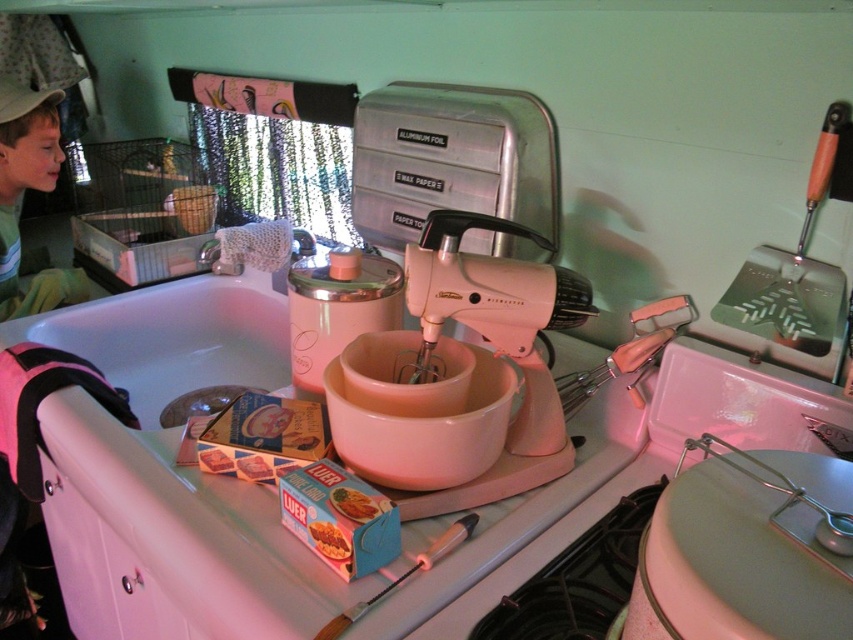
Does pink plastic mixer at center come behind matte cardboard box of luer at center?

Yes, pink plastic mixer at center is behind matte cardboard box of luer at center.

Is pink plastic mixer at center positioned in front of matte cardboard box of luer at center?

No, it is not.

Which is behind, point (526, 300) or point (352, 520)?

Point (526, 300)

Image resolution: width=853 pixels, height=640 pixels. What are the coordinates of `pink plastic mixer at center` in the screenshot? It's located at (459, 372).

Is green cotton shirt at upper left taller than smooth cardboard box of spaghetti at lower center?

Indeed, green cotton shirt at upper left has a greater height compared to smooth cardboard box of spaghetti at lower center.

Does green cotton shirt at upper left appear under smooth cardboard box of spaghetti at lower center?

Actually, green cotton shirt at upper left is above smooth cardboard box of spaghetti at lower center.

Find the location of `green cotton shirt at upper left`. green cotton shirt at upper left is located at coordinates (22, 196).

Locate an element on the screen. The height and width of the screenshot is (640, 853). green cotton shirt at upper left is located at coordinates (22, 196).

Can you confirm if matte cardboard box of luer at center is taller than smooth cardboard box of spaghetti at lower center?

No, matte cardboard box of luer at center is not taller than smooth cardboard box of spaghetti at lower center.

Describe the element at coordinates (354, 502) in the screenshot. Image resolution: width=853 pixels, height=640 pixels. I see `matte cardboard box of luer at center` at that location.

This screenshot has height=640, width=853. I want to click on matte cardboard box of luer at center, so click(x=354, y=502).

Identify the location of matte cardboard box of luer at center. (354, 502).